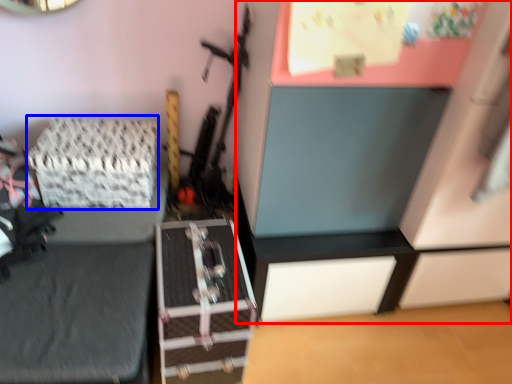
Question: Which object appears closest to the camera in this image, dresser (highlighted by a red box) or package (highlighted by a blue box)?

Choices:
 (A) dresser
 (B) package

Answer: (A)